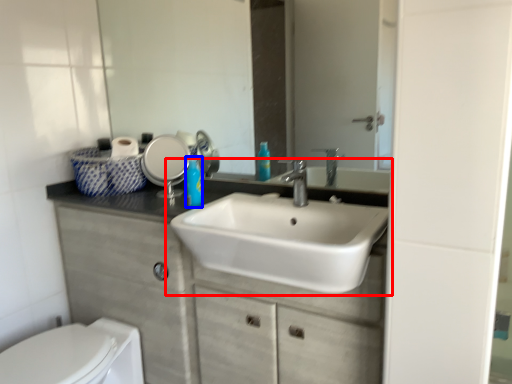
Question: Which object is further to the camera taking this photo, sink (highlighted by a red box) or soap dispenser (highlighted by a blue box)?

Choices:
 (A) sink
 (B) soap dispenser

Answer: (B)